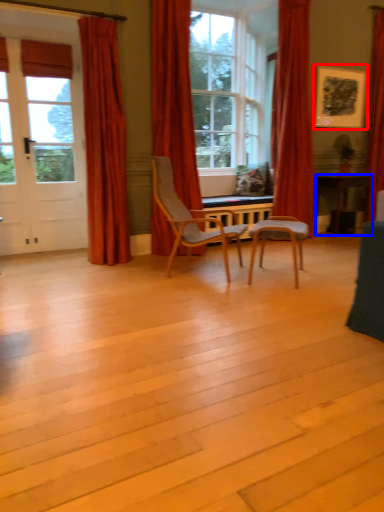
Question: Which object appears closest to the camera in this image, picture frame (highlighted by a red box) or desk (highlighted by a blue box)?

Choices:
 (A) picture frame
 (B) desk

Answer: (A)